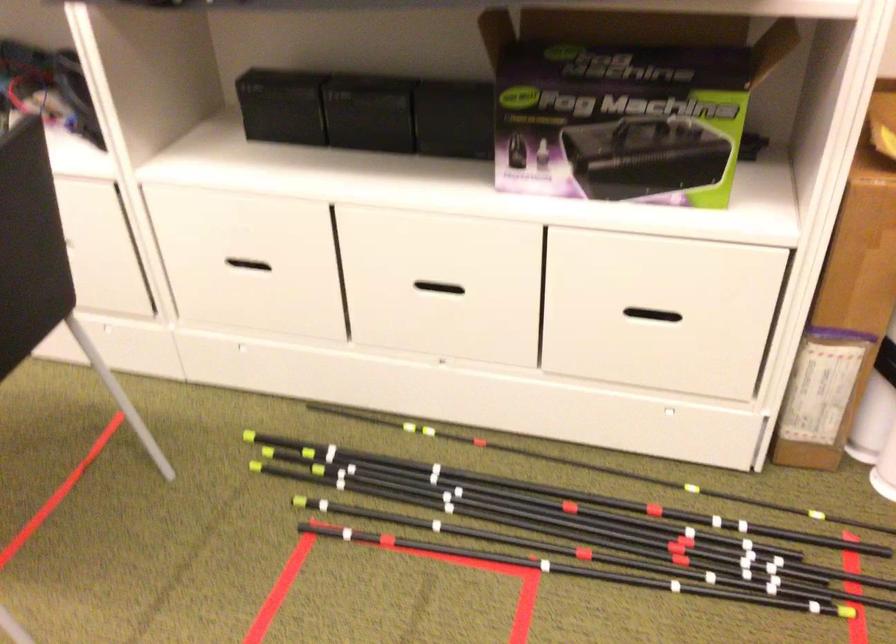
Find the location of a particular element. Image resolution: width=896 pixels, height=644 pixels. fog machine box is located at coordinates (625, 102).